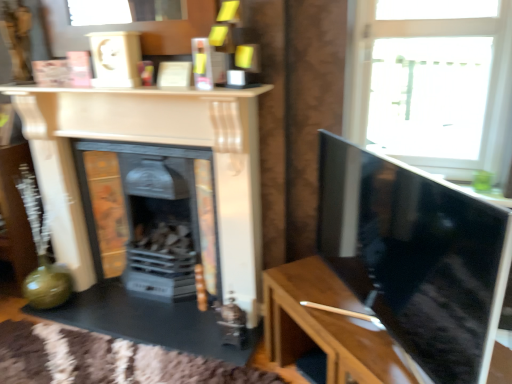
I want to click on matte cream fireplace at center, which ranks as the 1th fireplace in front-to-back order, so click(x=154, y=142).

What do you see at coordinates (154, 142) in the screenshot? The image size is (512, 384). I see `matte cream fireplace at center, which ranks as the 1th fireplace in front-to-back order` at bounding box center [154, 142].

The image size is (512, 384). What do you see at coordinates (150, 215) in the screenshot? I see `matte black fireplace at center, marked as the 2th fireplace in a front-to-back arrangement` at bounding box center [150, 215].

Locate an element on the screen. transparent glass window at upper right is located at coordinates (433, 41).

What is the approximate width of wooden table at right?

wooden table at right is 18.07 inches in width.

Find the location of a particular element. Image resolution: width=512 pixels, height=384 pixels. black glossy tv at right is located at coordinates (415, 256).

Measure the distance between point (403, 206) and camera.

Point (403, 206) is 1.17 meters away from camera.

The height and width of the screenshot is (384, 512). In order to click on matte cream fireplace at center, which is the 2th fireplace in back-to-front order in this screenshot , I will do `click(154, 142)`.

Is point (368, 111) closer to camera compared to point (297, 314)?

No.

Between transparent glass window at upper right and wooden table at right, which one has less height?

wooden table at right.

Considering the positions of objects transparent glass window at upper right and wooden table at right in the image provided, who is behind, transparent glass window at upper right or wooden table at right?

transparent glass window at upper right is more distant.

Is transparent glass window at upper right placed right next to wooden table at right?

No, transparent glass window at upper right is not in contact with wooden table at right.

From a real-world perspective, is matte black fireplace at center, positioned as the 1th fireplace in back-to-front order, on top of transparent glass window at upper right?

No.

Considering the relative sizes of matte black fireplace at center, marked as the 2th fireplace in a front-to-back arrangement, and transparent glass window at upper right in the image provided, is matte black fireplace at center, marked as the 2th fireplace in a front-to-back arrangement, smaller than transparent glass window at upper right?

Incorrect, matte black fireplace at center, marked as the 2th fireplace in a front-to-back arrangement, is not smaller in size than transparent glass window at upper right.

From the image's perspective, who appears lower, matte black fireplace at center, marked as the 2th fireplace in a front-to-back arrangement, or transparent glass window at upper right?

matte black fireplace at center, marked as the 2th fireplace in a front-to-back arrangement.

Is matte black fireplace at center, positioned as the 1th fireplace in back-to-front order, inside the boundaries of transparent glass window at upper right, or outside?

matte black fireplace at center, positioned as the 1th fireplace in back-to-front order, lies outside transparent glass window at upper right.

Measure the distance between matte black fireplace at center, positioned as the 1th fireplace in back-to-front order, and wooden table at right.

The distance of matte black fireplace at center, positioned as the 1th fireplace in back-to-front order, from wooden table at right is 30.55 inches.

Is matte black fireplace at center, marked as the 2th fireplace in a front-to-back arrangement, facing away from wooden table at right?

matte black fireplace at center, marked as the 2th fireplace in a front-to-back arrangement, does not have its back to wooden table at right.

Between matte black fireplace at center, marked as the 2th fireplace in a front-to-back arrangement, and wooden table at right, which one has smaller size?

wooden table at right.

Considering the sizes of objects matte black fireplace at center, marked as the 2th fireplace in a front-to-back arrangement, and wooden table at right in the image provided, who is shorter, matte black fireplace at center, marked as the 2th fireplace in a front-to-back arrangement, or wooden table at right?

With less height is wooden table at right.

This screenshot has height=384, width=512. What are the coordinates of `screen that appears on the right of matte black fireplace at center, positioned as the 1th fireplace in back-to-front order` in the screenshot? It's located at (415, 256).

Is black glossy tv at right surrounded by matte black fireplace at center, positioned as the 1th fireplace in back-to-front order?

No, black glossy tv at right is not inside matte black fireplace at center, positioned as the 1th fireplace in back-to-front order.

From a real-world perspective, is matte black fireplace at center, positioned as the 1th fireplace in back-to-front order, above or below black glossy tv at right?

In terms of real-world spatial position, matte black fireplace at center, positioned as the 1th fireplace in back-to-front order, is below black glossy tv at right.

Considering the sizes of objects black glossy tv at right and matte black fireplace at center, marked as the 2th fireplace in a front-to-back arrangement, in the image provided, who is shorter, black glossy tv at right or matte black fireplace at center, marked as the 2th fireplace in a front-to-back arrangement,?

Standing shorter between the two is black glossy tv at right.

From a real-world perspective, is black glossy tv at right above or below matte black fireplace at center, positioned as the 1th fireplace in back-to-front order?

In terms of real-world spatial position, black glossy tv at right is above matte black fireplace at center, positioned as the 1th fireplace in back-to-front order.

Which point is more forward, (328, 250) or (293, 275)?

Positioned in front is point (328, 250).

Are black glossy tv at right and wooden table at right beside each other?

black glossy tv at right and wooden table at right are not in contact.

From the image's perspective, who appears lower, black glossy tv at right or wooden table at right?

wooden table at right, from the image's perspective.

This screenshot has height=384, width=512. In order to click on table located on the right of black glossy tv at right in this screenshot , I will do tap(325, 326).

Is matte cream fireplace at center, which is the 2th fireplace in back-to-front order, oriented towards black glossy tv at right?

No.

From the image's perspective, between matte cream fireplace at center, which ranks as the 1th fireplace in front-to-back order, and black glossy tv at right, which one is located above?

matte cream fireplace at center, which ranks as the 1th fireplace in front-to-back order, from the image's perspective.

Is matte cream fireplace at center, which is the 2th fireplace in back-to-front order, not within black glossy tv at right?

matte cream fireplace at center, which is the 2th fireplace in back-to-front order, is positioned outside black glossy tv at right.

Is matte cream fireplace at center, which ranks as the 1th fireplace in front-to-back order, next to black glossy tv at right and touching it?

matte cream fireplace at center, which ranks as the 1th fireplace in front-to-back order, is not next to black glossy tv at right, and they're not touching.

The height and width of the screenshot is (384, 512). I want to click on window that appears above the wooden table at right (from the image's perspective), so click(x=433, y=41).

There is a transparent glass window at upper right. Where is `the 2nd fireplace below it (from the image's perspective)`? the 2nd fireplace below it (from the image's perspective) is located at coordinates (150, 215).

Looking at the image, which one is located closer to matte cream fireplace at center, which ranks as the 1th fireplace in front-to-back order, matte black fireplace at center, marked as the 2th fireplace in a front-to-back arrangement, or wooden table at right?

matte black fireplace at center, marked as the 2th fireplace in a front-to-back arrangement, is closer to matte cream fireplace at center, which ranks as the 1th fireplace in front-to-back order.

From the image, which object appears to be farther from wooden table at right, matte cream fireplace at center, which ranks as the 1th fireplace in front-to-back order, or black glossy tv at right?

matte cream fireplace at center, which ranks as the 1th fireplace in front-to-back order.

Based on their spatial positions, is transparent glass window at upper right or matte cream fireplace at center, which is the 2th fireplace in back-to-front order, closer to wooden table at right?

matte cream fireplace at center, which is the 2th fireplace in back-to-front order, lies closer to wooden table at right than the other object.

Looking at the image, which one is located further to black glossy tv at right, transparent glass window at upper right or matte black fireplace at center, marked as the 2th fireplace in a front-to-back arrangement?

matte black fireplace at center, marked as the 2th fireplace in a front-to-back arrangement, is positioned further to the anchor black glossy tv at right.

From the image, which object appears to be farther from black glossy tv at right, matte black fireplace at center, marked as the 2th fireplace in a front-to-back arrangement, or wooden table at right?

The object further to black glossy tv at right is matte black fireplace at center, marked as the 2th fireplace in a front-to-back arrangement.

When comparing their distances from matte black fireplace at center, marked as the 2th fireplace in a front-to-back arrangement, does transparent glass window at upper right or matte cream fireplace at center, which ranks as the 1th fireplace in front-to-back order, seem closer?

Based on the image, matte cream fireplace at center, which ranks as the 1th fireplace in front-to-back order, appears to be nearer to matte black fireplace at center, marked as the 2th fireplace in a front-to-back arrangement.

Which object lies further to the anchor point wooden table at right, transparent glass window at upper right or matte black fireplace at center, positioned as the 1th fireplace in back-to-front order?

transparent glass window at upper right is further to wooden table at right.

Estimate the real-world distances between objects in this image. Which object is further from matte cream fireplace at center, which ranks as the 1th fireplace in front-to-back order, wooden table at right or black glossy tv at right?

Based on the image, black glossy tv at right appears to be further to matte cream fireplace at center, which ranks as the 1th fireplace in front-to-back order.

I want to click on screen between matte cream fireplace at center, which is the 2th fireplace in back-to-front order, and transparent glass window at upper right, in the horizontal direction, so click(x=415, y=256).

I want to click on screen situated between matte cream fireplace at center, which ranks as the 1th fireplace in front-to-back order, and wooden table at right from left to right, so click(x=415, y=256).

Identify the location of table between matte black fireplace at center, positioned as the 1th fireplace in back-to-front order, and transparent glass window at upper right, in the horizontal direction. This screenshot has height=384, width=512. (325, 326).

Locate an element on the screen. The height and width of the screenshot is (384, 512). screen between matte black fireplace at center, positioned as the 1th fireplace in back-to-front order, and transparent glass window at upper right from left to right is located at coordinates (415, 256).